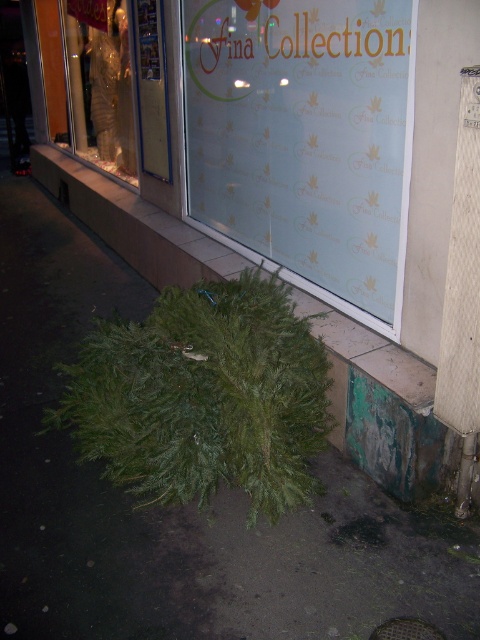
Question: Which point is farther to the camera?

Choices:
 (A) (92, 388)
 (B) (105, 248)

Answer: (B)

Question: Is green natural tree at lower center to the right of green leafy plant at lower left from the viewer's perspective?

Choices:
 (A) no
 (B) yes

Answer: (B)

Question: Where is frosted glass window at center located in relation to green leafy plant at lower left in the image?

Choices:
 (A) below
 (B) above

Answer: (B)

Question: Which point is farther from the camera taking this photo?

Choices:
 (A) (95, 67)
 (B) (269, 396)

Answer: (A)

Question: Can you confirm if green leafy plant at lower left is positioned below gold metallic mannequin at upper left?

Choices:
 (A) no
 (B) yes

Answer: (B)

Question: Which object appears farthest from the camera in this image?

Choices:
 (A) gold metallic mannequin at upper left
 (B) green natural tree at lower center

Answer: (A)